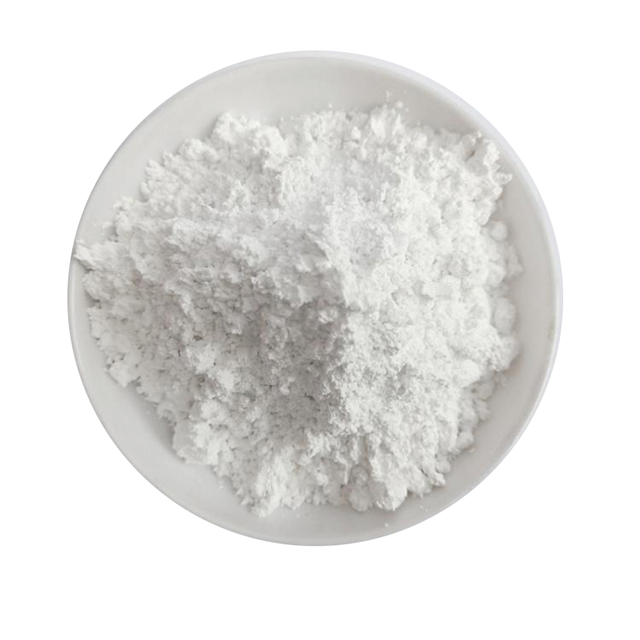
The width and height of the screenshot is (640, 640). Find the location of `the bottom rim of bowl`. the bottom rim of bowl is located at coordinates (319, 544).